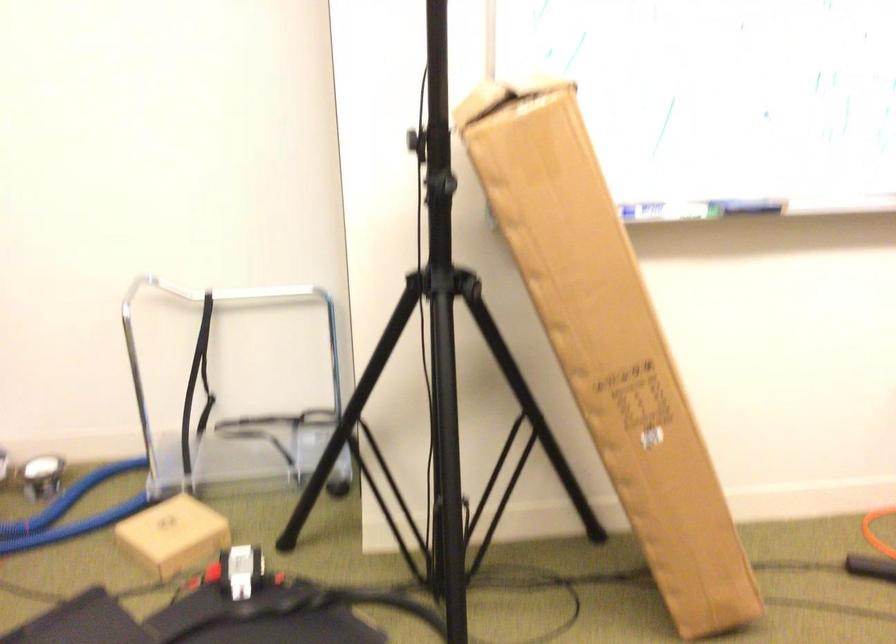
This screenshot has height=644, width=896. What do you see at coordinates (416, 140) in the screenshot?
I see `a black tripod knob` at bounding box center [416, 140].